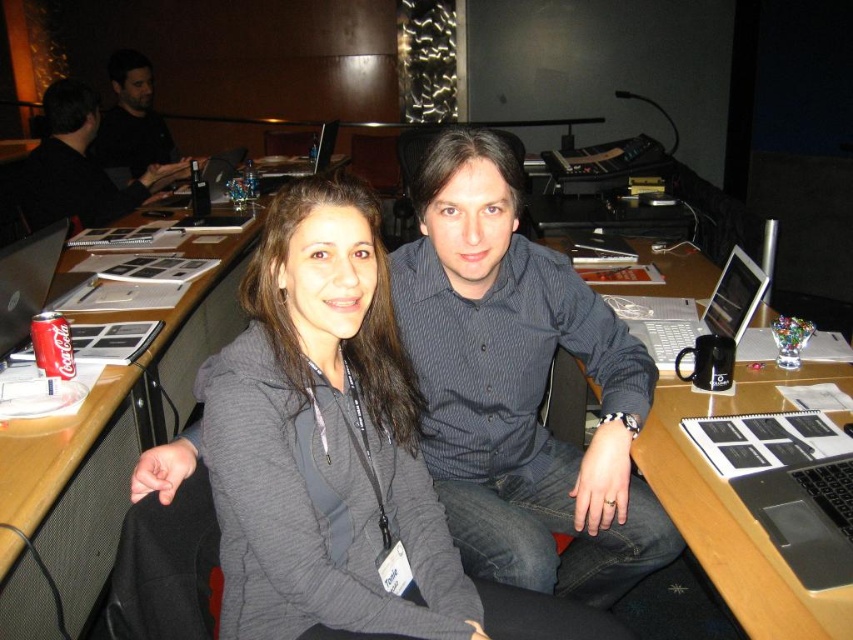
Question: Is black plastic laptop at center bigger than black shirt at upper left?

Choices:
 (A) no
 (B) yes

Answer: (B)

Question: Among these objects, which one is nearest to the camera?

Choices:
 (A) gray fleece jacket at center
 (B) silver metallic laptop at center
 (C) black plastic laptop at center
 (D) wooden table at center

Answer: (C)

Question: Where is silver metallic laptop at center located in relation to coca-cola can at center in the image?

Choices:
 (A) right
 (B) left

Answer: (A)

Question: Which point is farther to the camera?

Choices:
 (A) (740, 330)
 (B) (665, 301)
 (C) (26, 212)

Answer: (C)

Question: Which object is positioned farthest from the matte black laptop at right?

Choices:
 (A) wooden table at center
 (B) gray fleece jacket at center
 (C) metallic silver laptop at center
 (D) black glossy laptop at upper center

Answer: (D)

Question: Does dark gray shirt at upper left come behind coca-cola can at center?

Choices:
 (A) no
 (B) yes

Answer: (B)